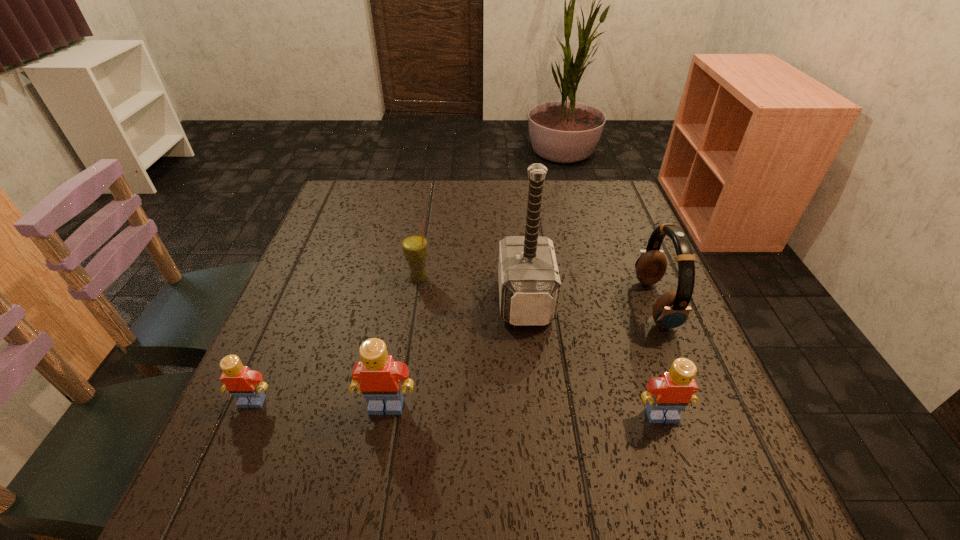
Locate an element on the screen. The height and width of the screenshot is (540, 960). Lego identified as the closest to the second Lego from right to left is located at coordinates (246, 385).

Locate an element on the screen. Lego object that ranks as the second closest to the headset is located at coordinates (377, 375).

You are a GUI agent. You are given a task and a screenshot of the screen. Output one action in this format:
    pyautogui.click(x=<x>, y=<y>)
    Task: Click on the free space that satisfies the following two spatial constraints: 1. for striking with the head of the tallest object; 2. on the front-facing side of the leftmost Lego
    Image resolution: width=960 pixels, height=540 pixels.
    Given the screenshot: What is the action you would take?
    pyautogui.click(x=536, y=401)

Locate an element on the screen. vacant space that satisfies the following two spatial constraints: 1. on the ear cup of the headset; 2. on the front-facing side of the second Lego from right to left is located at coordinates (696, 406).

Where is `vacant space that satisfies the following two spatial constraints: 1. on the ear cup of the headset; 2. on the front-facing side of the leftmost object`? This screenshot has width=960, height=540. vacant space that satisfies the following two spatial constraints: 1. on the ear cup of the headset; 2. on the front-facing side of the leftmost object is located at coordinates (694, 401).

Where is `vacant position in the image that satisfies the following two spatial constraints: 1. on the ear cup of the headset; 2. on the front-facing side of the shortest object`? The height and width of the screenshot is (540, 960). vacant position in the image that satisfies the following two spatial constraints: 1. on the ear cup of the headset; 2. on the front-facing side of the shortest object is located at coordinates (694, 401).

Find the location of `vacant space that satisfies the following two spatial constraints: 1. for striking with the head of the fourth object from left to right; 2. on the front-facing side of the second Lego from right to left`. vacant space that satisfies the following two spatial constraints: 1. for striking with the head of the fourth object from left to right; 2. on the front-facing side of the second Lego from right to left is located at coordinates click(x=537, y=406).